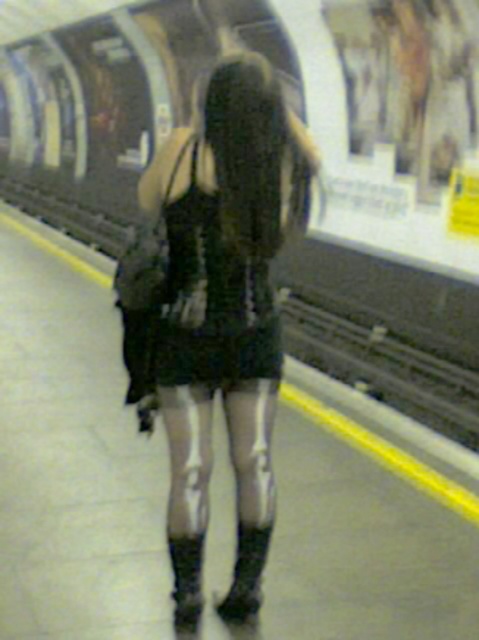
You are a passenger waiting on the subway platform. You notice the metallic gray train at center and the leather boots at lower center. Which object is taller from your perspective?

The metallic gray train at center is taller than the leather boots at lower center.